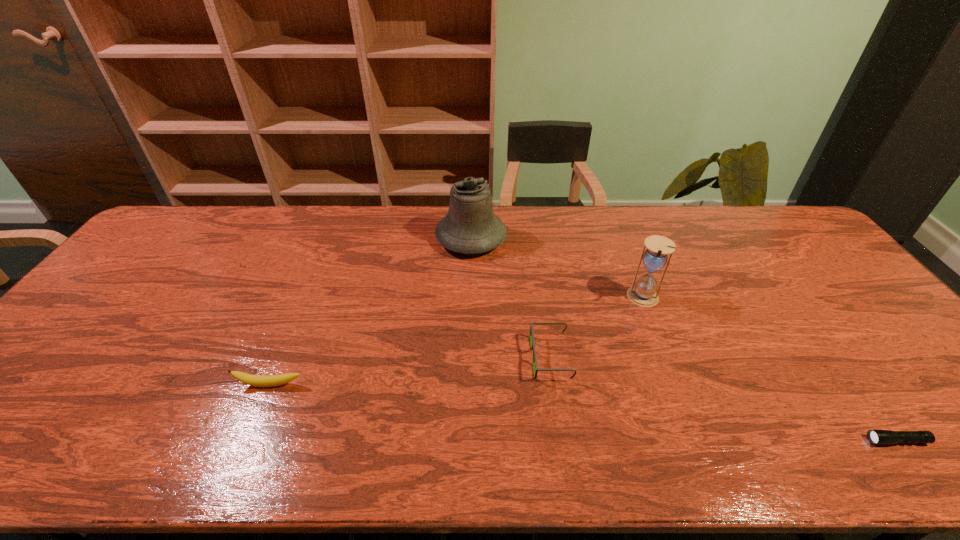
Find the location of a particular element. The height and width of the screenshot is (540, 960). free space between the banana and the fourth object from left to right is located at coordinates coord(457,341).

Image resolution: width=960 pixels, height=540 pixels. I want to click on free space between the third object from left to right and the hourglass, so click(597, 328).

The height and width of the screenshot is (540, 960). Find the location of `free space between the spectacles and the fourth nearest object`. free space between the spectacles and the fourth nearest object is located at coordinates (597, 328).

Locate an element on the screen. Image resolution: width=960 pixels, height=540 pixels. free space between the bell and the hourglass is located at coordinates pyautogui.click(x=558, y=268).

The image size is (960, 540). I want to click on empty space that is in between the hourglass and the spectacles, so click(597, 328).

Image resolution: width=960 pixels, height=540 pixels. I want to click on free spot between the second object from left to right and the rightmost object, so click(x=684, y=339).

You are a GUI agent. You are given a task and a screenshot of the screen. Output one action in this format:
    pyautogui.click(x=<x>, y=<y>)
    Task: Click on the object that stands as the second closest to the third object from right to left
    The height and width of the screenshot is (540, 960).
    Given the screenshot: What is the action you would take?
    pyautogui.click(x=470, y=227)

Locate which object ranks fourth in proximity to the shortest object. Please provide its 2D coordinates. Your answer should be formatted as a tuple, i.e. [(x, y)], where the tuple contains the x and y coordinates of a point satisfying the conditions above.

[(254, 380)]

This screenshot has width=960, height=540. Find the location of `vacant space that satisfies the following two spatial constraints: 1. on the front side of the hourglass; 2. on the lens of the spectacles`. vacant space that satisfies the following two spatial constraints: 1. on the front side of the hourglass; 2. on the lens of the spectacles is located at coordinates (666, 357).

Find the location of a particular element. vacant space that satisfies the following two spatial constraints: 1. on the lens of the spectacles; 2. on the upward curve of the banana is located at coordinates (555, 384).